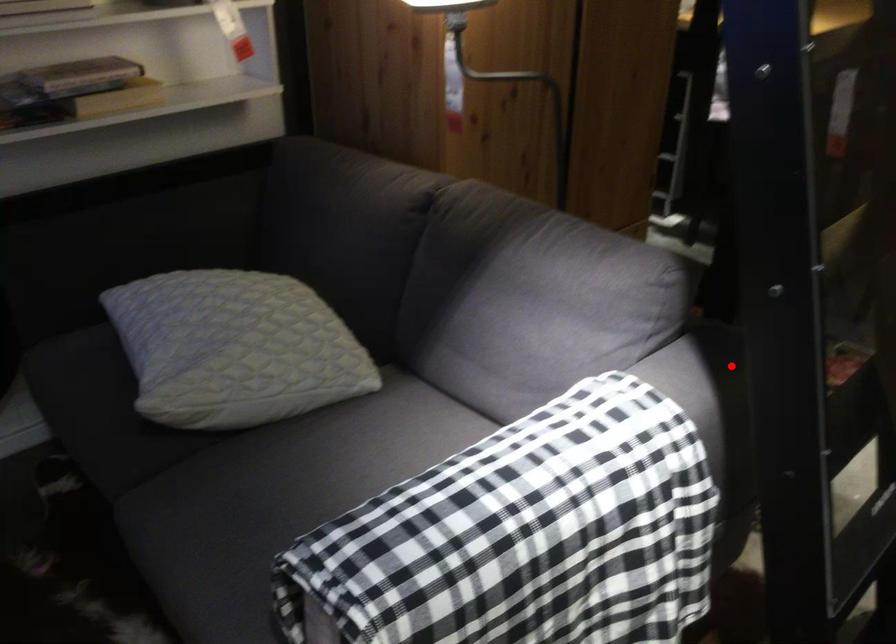
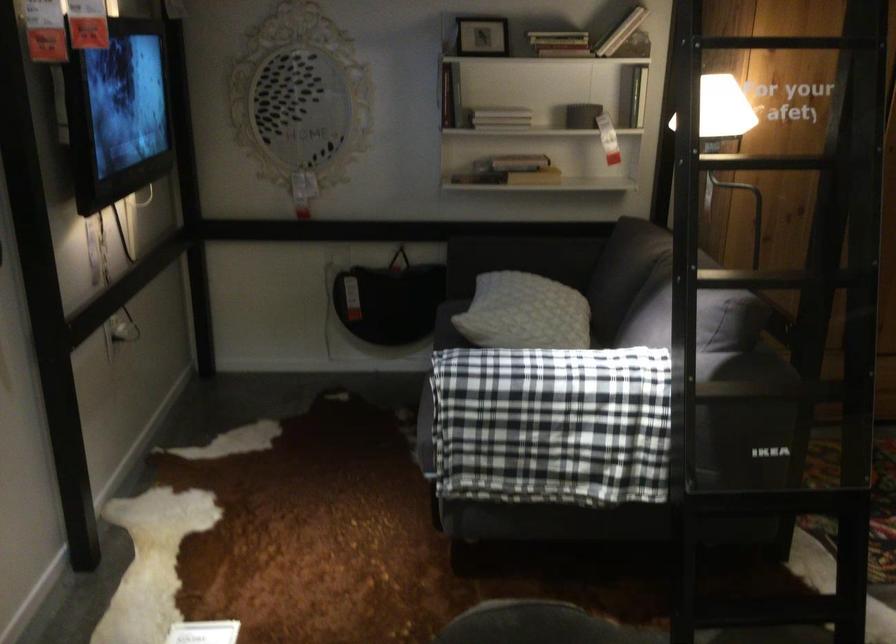
Question: I am providing you with two images of the same scene from different viewpoints. A red point is shown in image1. For the corresponding object point in image2, is it positioned nearer or farther from the camera?

Choices:
 (A) Nearer
 (B) Farther

Answer: (B)